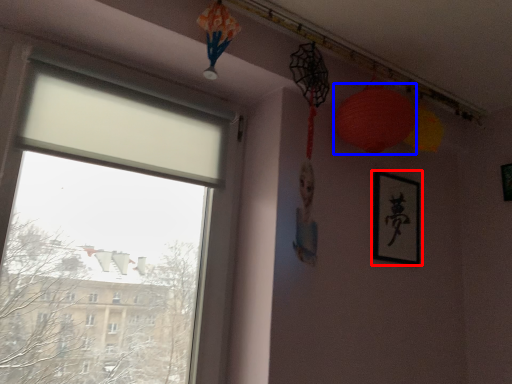
Question: Which object is further to the camera taking this photo, picture frame (highlighted by a red box) or lantern (highlighted by a blue box)?

Choices:
 (A) picture frame
 (B) lantern

Answer: (A)